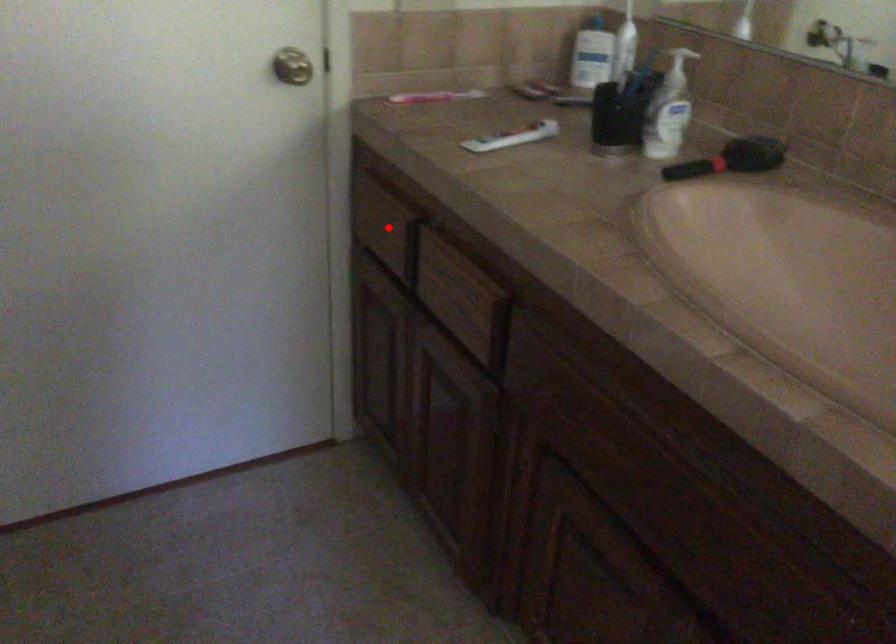
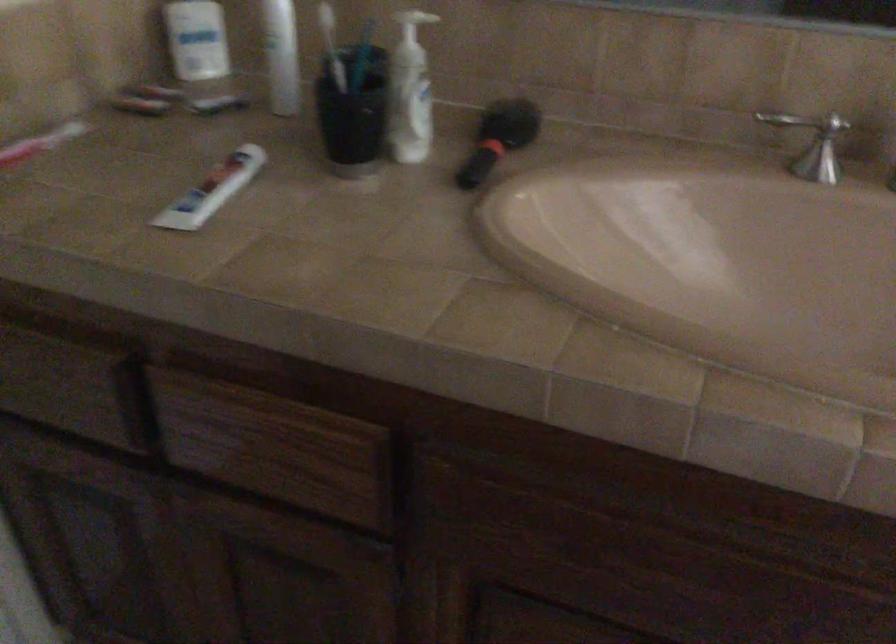
Question: I am providing you with two images of the same scene from different viewpoints. In image1, a red point is highlighted. Considering the same 3D point in image2, which of the following is correct?

Choices:
 (A) It is closer
 (B) It is farther

Answer: (A)